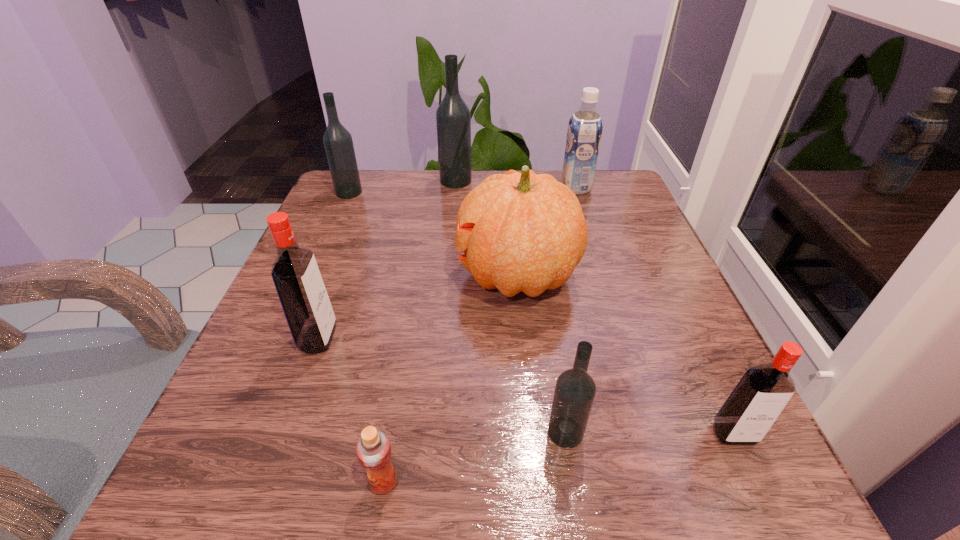
At what (x,y) coordinates should I click in order to perform the action: click on vacant region located on the carved face of the fourth farthest object. Please return your answer as a coordinate pair (x, y). The height and width of the screenshot is (540, 960). Looking at the image, I should click on (329, 274).

You are a GUI agent. You are given a task and a screenshot of the screen. Output one action in this format:
    pyautogui.click(x=<x>, y=<y>)
    Task: Click on the blank space located on the front of the second biggest black vodka
    
    Given the screenshot: What is the action you would take?
    pyautogui.click(x=327, y=241)

Identify the location of free space located 0.110m on the front and back of the bigger red vodka. (400, 338).

Where is `free spot located 0.140m on the left of the rightmost black vodka`? This screenshot has width=960, height=540. free spot located 0.140m on the left of the rightmost black vodka is located at coordinates (446, 432).

Where is `vacant space located 0.070m on the front and back of the rightmost vodka`? This screenshot has height=540, width=960. vacant space located 0.070m on the front and back of the rightmost vodka is located at coordinates (766, 501).

You are a GUI agent. You are given a task and a screenshot of the screen. Output one action in this format:
    pyautogui.click(x=<x>, y=<y>)
    Task: Click on the free spot located 0.350m on the right of the nearest object
    This screenshot has width=960, height=540.
    Given the screenshot: What is the action you would take?
    pyautogui.click(x=676, y=482)

This screenshot has height=540, width=960. In order to click on soya milk positioned at the far edge in this screenshot , I will do coord(585,126).

The height and width of the screenshot is (540, 960). I want to click on orange juice at the near edge, so pos(373,449).

This screenshot has width=960, height=540. I want to click on soya milk that is at the right edge, so click(585, 126).

At what (x,y) coordinates should I click in order to perform the action: click on vodka that is at the right edge. Please return your answer as a coordinate pair (x, y). Looking at the image, I should click on (762, 393).